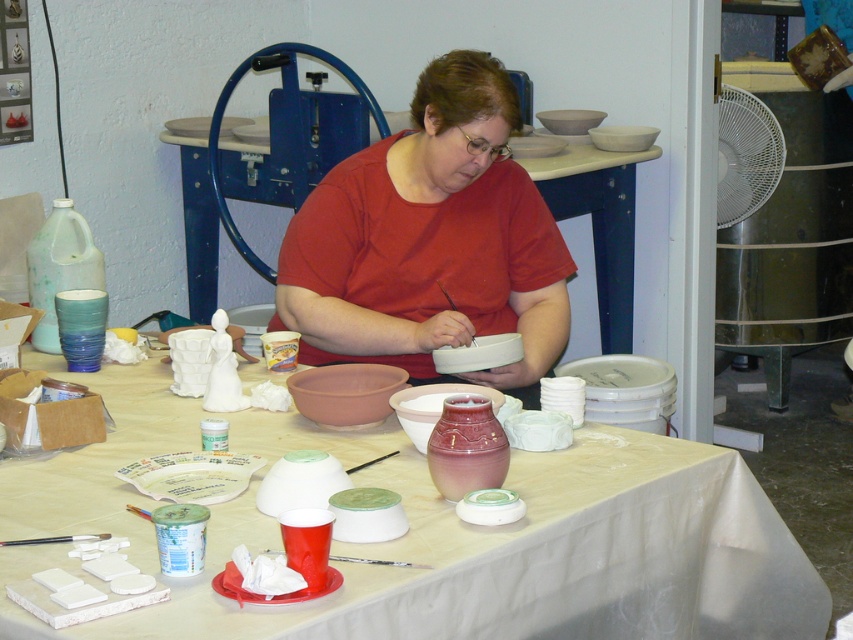
Question: Does white glossy table at center appear on the right side of matte blue bowl at left?

Choices:
 (A) yes
 (B) no

Answer: (A)

Question: Which point is closer to the camera?

Choices:
 (A) white matte table at center
 (B) matte pink ceramic vase at center
 (C) matte red shirt at center

Answer: (A)

Question: Which of the following is the closest to the observer?

Choices:
 (A) (518, 625)
 (B) (624, 170)
 (C) (494, 448)
 (D) (350, 272)

Answer: (A)

Question: Does white matte table at center have a larger size compared to matte red shirt at center?

Choices:
 (A) no
 (B) yes

Answer: (B)

Question: Which is farther from the matte pink ceramic vase at center?

Choices:
 (A) white matte table at center
 (B) white glossy table at center
 (C) matte red shirt at center

Answer: (B)

Question: Is matte red shirt at center to the left of white glossy table at center from the viewer's perspective?

Choices:
 (A) no
 (B) yes

Answer: (B)